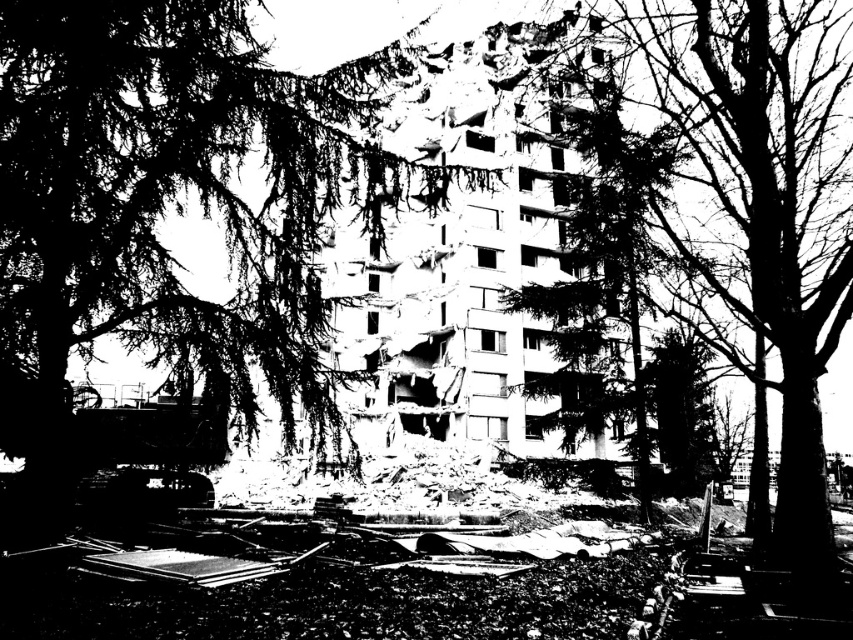
You are a construction worker assessing the demolition site. You notice two trees, the dark green textured tree at left and the dark green leafy tree at center. Which tree is taller?

The dark green leafy tree at center is taller than the dark green textured tree at left.

You are a bird flying over the demolished building. You want to land on a dark green textured tree at left and then move to the dark green leafy tree at center. Which direction should you fly to reach the second tree from the first?

The dark green textured tree at left is above the dark green leafy tree at center, so you should fly downward to reach the dark green leafy tree at center from the dark green textured tree at left.